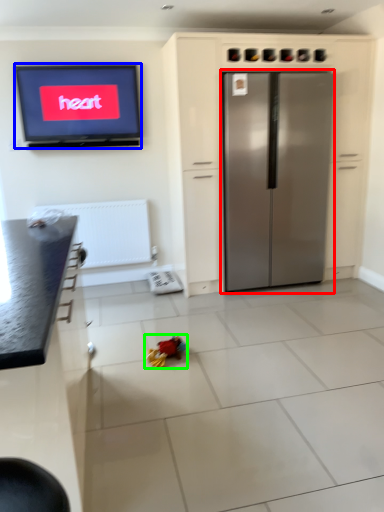
Question: Estimate the real-world distances between objects in this image. Which object is closer to refrigerator (highlighted by a red box), television (highlighted by a blue box) or toy (highlighted by a green box)?

Choices:
 (A) television
 (B) toy

Answer: (A)